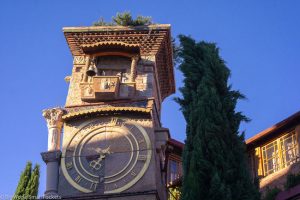
The width and height of the screenshot is (300, 200). I want to click on clock, so click(109, 150).